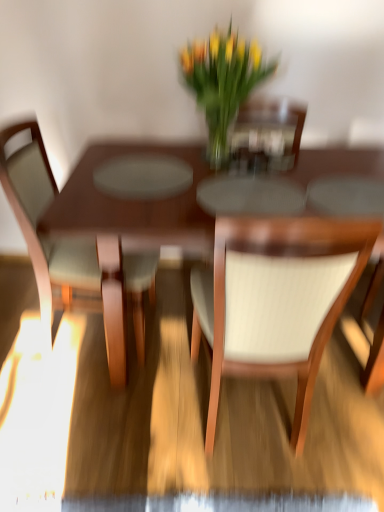
You are a GUI agent. You are given a task and a screenshot of the screen. Output one action in this format:
    pyautogui.click(x=<x>, y=<y>)
    Task: Click on the vacant area to the left of white textured chair at center, the 1th chair in the right-to-left sequence
    Image resolution: width=384 pixels, height=512 pixels.
    Given the screenshot: What is the action you would take?
    pyautogui.click(x=147, y=421)